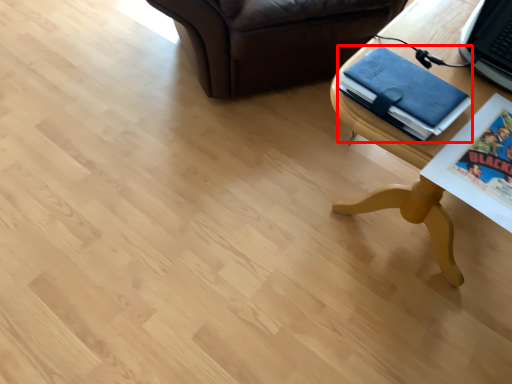
Question: From the image's perspective, what is the correct spatial relationship of binder (annotated by the red box) in relation to table?

Choices:
 (A) above
 (B) below

Answer: (B)